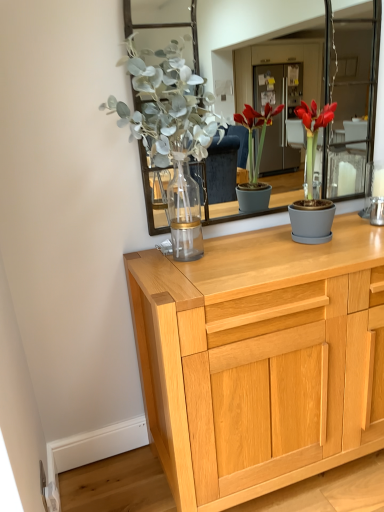
At what (x,y) coordinates should I click in order to perform the action: click on matte gray pot at center. Please return your answer as a coordinate pair (x, y). The width and height of the screenshot is (384, 512). Looking at the image, I should click on (312, 183).

The height and width of the screenshot is (512, 384). What do you see at coordinates (312, 183) in the screenshot?
I see `matte gray pot at center` at bounding box center [312, 183].

Based on the photo, in order to face light oak wooden chest of drawers at center, should I rotate leftwards or rightwards?

Turn right by 14.986 degrees to look at light oak wooden chest of drawers at center.

What do you see at coordinates (261, 359) in the screenshot?
I see `light oak wooden chest of drawers at center` at bounding box center [261, 359].

This screenshot has height=512, width=384. I want to click on light oak wooden chest of drawers at center, so click(261, 359).

Image resolution: width=384 pixels, height=512 pixels. What are the coordinates of `matte gray pot at center` in the screenshot? It's located at (312, 183).

Which is more to the left, matte gray pot at center or light oak wooden chest of drawers at center?

light oak wooden chest of drawers at center is more to the left.

Which object is closer to the camera taking this photo, matte gray pot at center or light oak wooden chest of drawers at center?

light oak wooden chest of drawers at center.

Is point (324, 215) positioned in front of point (360, 240)?

Yes, point (324, 215) is in front of point (360, 240).

From the image's perspective, which one is positioned higher, matte gray pot at center or light oak wooden chest of drawers at center?

matte gray pot at center.

From a real-world perspective, between matte gray pot at center and light oak wooden chest of drawers at center, who is vertically higher?

In real-world perspective, matte gray pot at center is above.

Between matte gray pot at center and light oak wooden chest of drawers at center, which one has larger width?

With larger width is light oak wooden chest of drawers at center.

Between matte gray pot at center and light oak wooden chest of drawers at center, which one has more height?

light oak wooden chest of drawers at center.

Considering the sizes of matte gray pot at center and light oak wooden chest of drawers at center in the image, is matte gray pot at center bigger or smaller than light oak wooden chest of drawers at center?

Clearly, matte gray pot at center is smaller in size than light oak wooden chest of drawers at center.

Is matte gray pot at center positioned beyond the bounds of light oak wooden chest of drawers at center?

Absolutely, matte gray pot at center is external to light oak wooden chest of drawers at center.

Is matte gray pot at center not close to light oak wooden chest of drawers at center?

matte gray pot at center is actually quite close to light oak wooden chest of drawers at center.

Is matte gray pot at center aimed at light oak wooden chest of drawers at center?

No, matte gray pot at center does not turn towards light oak wooden chest of drawers at center.

This screenshot has width=384, height=512. Identify the location of the chest of drawers lying in front of the matte gray pot at center. (261, 359).

Which object is positioned more to the right, light oak wooden chest of drawers at center or matte gray pot at center?

matte gray pot at center.

Looking at this image, which is behind, light oak wooden chest of drawers at center or matte gray pot at center?

matte gray pot at center is more distant.

Which is in front, point (185, 506) or point (327, 237)?

Positioned in front is point (185, 506).

From the image's perspective, which object appears higher, light oak wooden chest of drawers at center or matte gray pot at center?

matte gray pot at center, from the image's perspective.

From a real-world perspective, which object rests below the other?

In real-world perspective, light oak wooden chest of drawers at center is lower.

Considering the relative sizes of light oak wooden chest of drawers at center and matte gray pot at center in the image provided, is light oak wooden chest of drawers at center thinner than matte gray pot at center?

In fact, light oak wooden chest of drawers at center might be wider than matte gray pot at center.

Between light oak wooden chest of drawers at center and matte gray pot at center, which one has more height?

With more height is light oak wooden chest of drawers at center.

Which of these two, light oak wooden chest of drawers at center or matte gray pot at center, is bigger?

With larger size is light oak wooden chest of drawers at center.

Choose the correct answer: Is light oak wooden chest of drawers at center inside matte gray pot at center or outside it?

light oak wooden chest of drawers at center is spatially situated outside matte gray pot at center.

Are light oak wooden chest of drawers at center and matte gray pot at center making contact?

light oak wooden chest of drawers at center and matte gray pot at center are clearly separated.

Is matte gray pot at center at the back of light oak wooden chest of drawers at center?

No.

Where is `houseplant above the light oak wooden chest of drawers at center (from the image's perspective)`? This screenshot has height=512, width=384. houseplant above the light oak wooden chest of drawers at center (from the image's perspective) is located at coordinates (312, 183).

Where is `the chest of drawers below the matte gray pot at center (from the image's perspective)`? This screenshot has height=512, width=384. the chest of drawers below the matte gray pot at center (from the image's perspective) is located at coordinates (261, 359).

I want to click on houseplant above the light oak wooden chest of drawers at center (from a real-world perspective), so click(x=312, y=183).